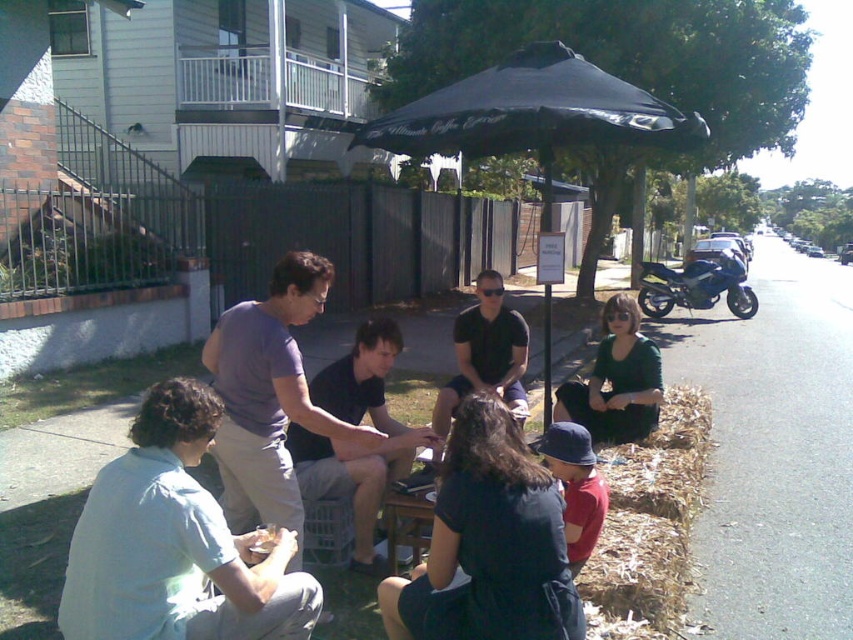
You are standing at the point labeled point (239, 406) and want to walk to the point labeled point (717, 257). According to the image, will you have to walk towards the group of people or away from them?

Since point (239, 406) is in front of point (717, 257), you would need to walk away from the group of people to reach point (717, 257).

You are a photographer standing at the edge of the residential street. You want to capture a photo of both the black matte shirt at center and the shiny blue motorcycle at right in the same frame. Given that your camera has a maximum focal length that allows capturing objects up to 15 meters apart, will you be able to include both in the photo?

The black matte shirt at center and the shiny blue motorcycle at right are 13.86 meters apart from each other. Since the maximum focal length allows capturing objects up to 15 meters apart, yes, you can include both in the photo because 13.86 meters is within the 15 meters limit.

You are a photographer trying to capture a group photo of the purple cotton shirt at center and the shiny blue motorcycle at right. Since you want both subjects to be clearly visible, which one should you focus on first to ensure proper focus, considering their sizes in the frame?

The purple cotton shirt at center has a lesser height compared to the shiny blue motorcycle at right, so you should focus on the shiny blue motorcycle at right first since it is larger and more prominent in the frame.